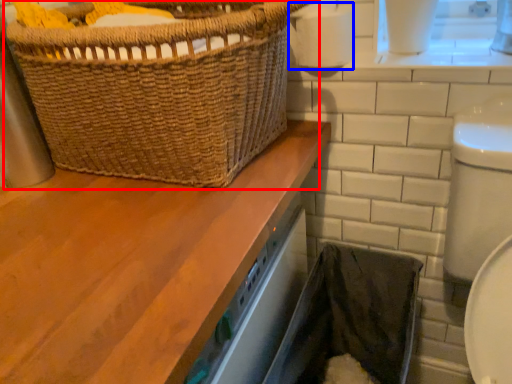
Question: Which object is further to the camera taking this photo, picnic basket (highlighted by a red box) or toilet paper (highlighted by a blue box)?

Choices:
 (A) picnic basket
 (B) toilet paper

Answer: (B)